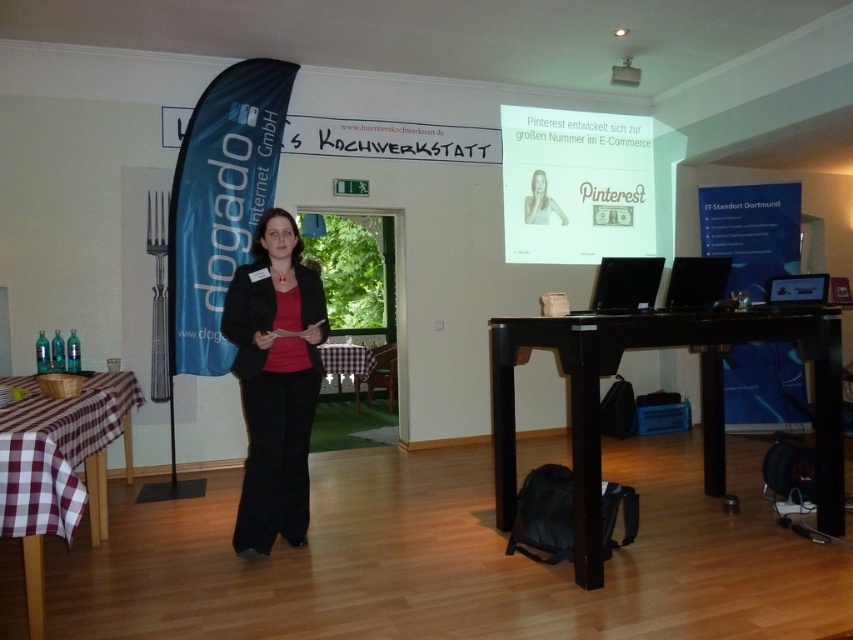
You are standing in the conference room and want to move from point A to point B. Point A is at coordinate point (723, 280) and point B is at coordinate point (344, 369). Which direction should you move to go from point A to point B?

To move from point A at coordinate point (723, 280) to point B at coordinate point (344, 369), you should move towards the upper right direction since point B is located above and to the right of point A.

You are organizing a presentation and need to place a decorative banner between the black fabric jacket at center and the black glossy monitor at right. Which object should the banner be placed closer to if you want it to be equidistant from both items?

The banner should be placed closer to the black glossy monitor at right because the black fabric jacket at center is wider than the black glossy monitor at right, making the center of the jacket farther away.